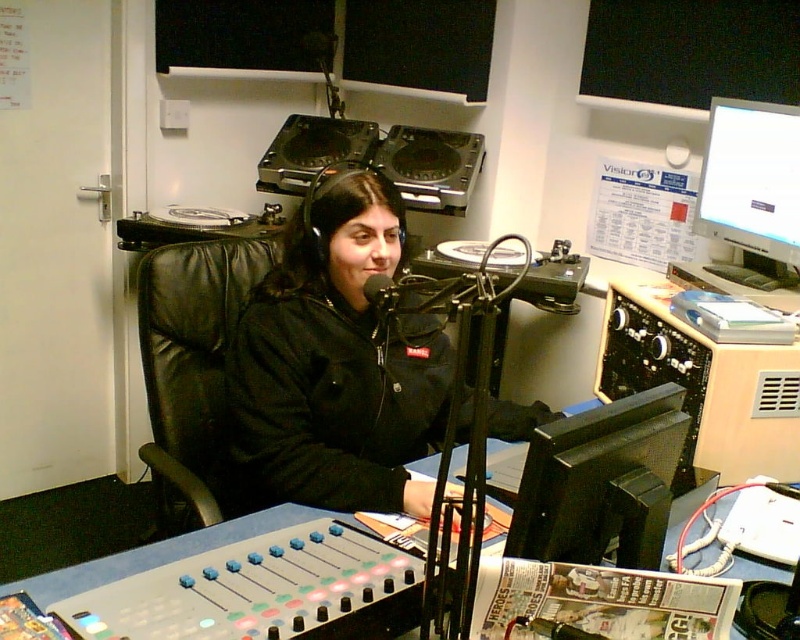
You are a visitor in the radio station and want to sit on the black leather chair at center. However, there is a matte black monitor at upper right nearby. Considering their widths, will the monitor block your access to the chair?

The black leather chair at center is wider than the matte black monitor at upper right, so the monitor will not block your access to the chair since it is narrower.